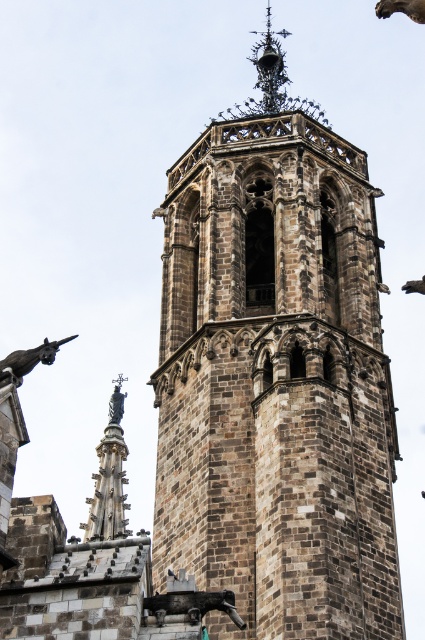
You are an architect examining the historic stone tower. You notice the brown stone tower at center and the dark gray stone gargoyle at lower left. Which object is closer to your current position?

The brown stone tower at center is closer to your current position because it is further to the viewer than the dark gray stone gargoyle at lower left.

You are a maintenance worker assessing the tower. You need to determine which object is closer to you for safety inspection. Which is closer to you, the black wrought iron spire at upper center or the dark gray stone gargoyle at lower left?

The dark gray stone gargoyle at lower left is closer to you because the black wrought iron spire at upper center is further away from the viewer.

You are an architect examining the historic stone tower. You need to determine which object, the black wrought iron spire at upper center or the dark gray stone gargoyle at lower left, requires more material for restoration. Based on their sizes, which one would need more material?

The black wrought iron spire at upper center has a larger size compared to the dark gray stone gargoyle at lower left, so it would require more material for restoration.